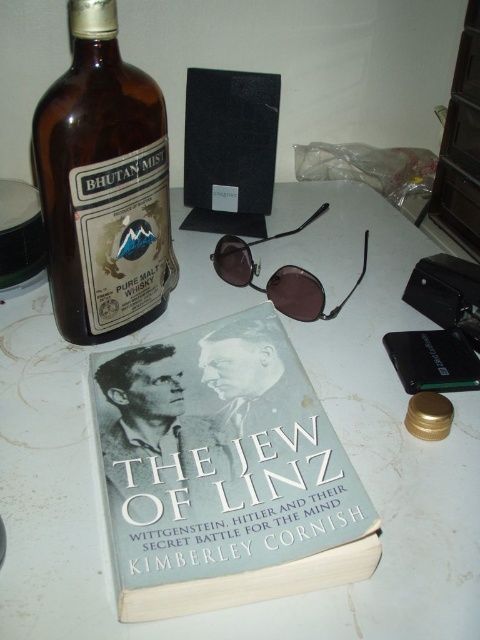
Is white matte table at center thinner than brown glass bottle at upper left?

No.

Describe the element at coordinates (324, 408) in the screenshot. I see `white matte table at center` at that location.

You are a GUI agent. You are given a task and a screenshot of the screen. Output one action in this format:
    pyautogui.click(x=<x>, y=<y>)
    Task: Click on the white matte table at center
    This screenshot has height=640, width=480.
    Given the screenshot: What is the action you would take?
    pyautogui.click(x=324, y=408)

Is white matte table at center closer to camera compared to hardcover book at center?

No, white matte table at center is further to the viewer.

Is point (72, 403) less distant than point (227, 595)?

No.

This screenshot has height=640, width=480. I want to click on white matte table at center, so click(x=324, y=408).

Measure the distance between white matte table at center and metallic brown sunglasses at center.

white matte table at center is 5.30 inches away from metallic brown sunglasses at center.

Between white matte table at center and metallic brown sunglasses at center, which one is positioned lower?

Positioned lower is white matte table at center.

At what (x,y) coordinates should I click in order to perform the action: click on white matte table at center. Please return your answer as a coordinate pair (x, y). Image resolution: width=480 pixels, height=640 pixels. Looking at the image, I should click on (324, 408).